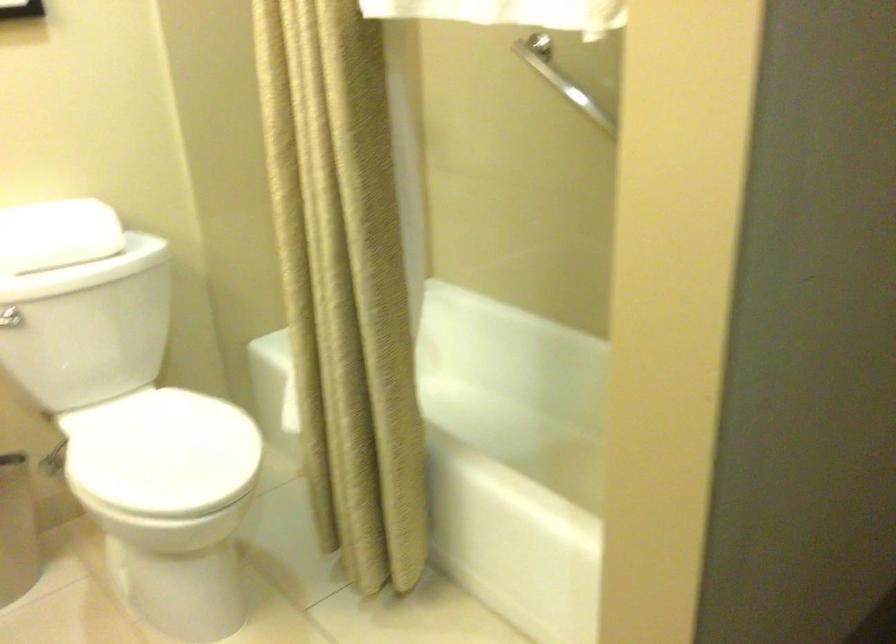
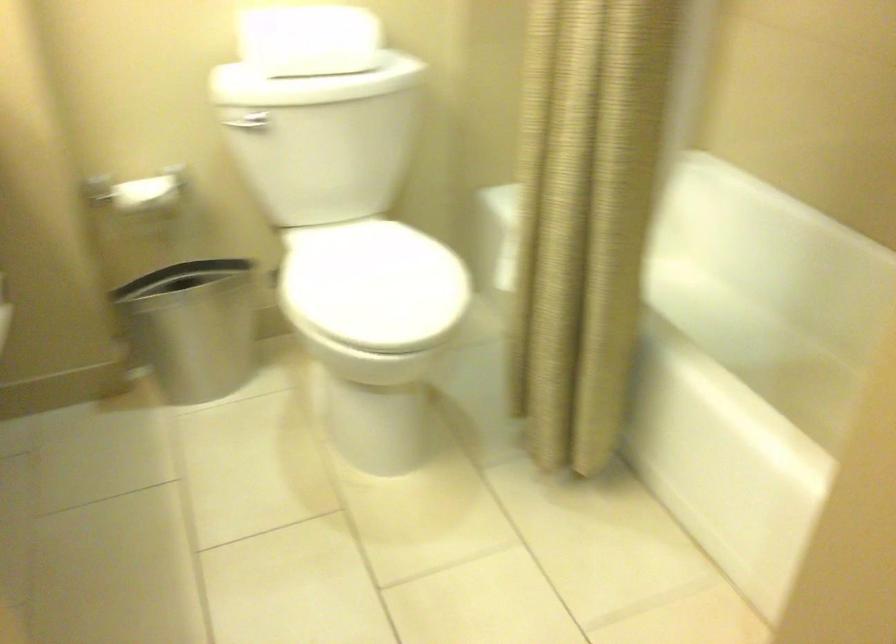
Locate, in the second image, the point that corresponds to the point at 359,366 in the first image.

(583, 230)